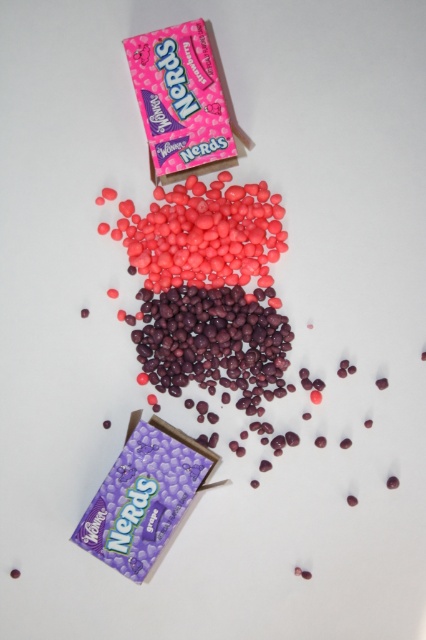
You are organizing a candy display and need to know the size difference between the glossy pink nerds at center and the pink matte nerds at upper left. Which one has a larger width?

The glossy pink nerds at center has a larger width than the pink matte nerds at upper left.

You are organizing a candy display and need to place a new sign. The sign will be placed at point coordinates between the glossy pink nerds at center and the purple package at bottom left corner. Based on their positions, which object is closer to the sign?

The glossy pink nerds at center is located at point coordinates closer to the sign than the purple package at bottom left corner, so the glossy pink nerds at center would be nearer to the sign.

You are standing in front of the two Wonka Nerds packages. You notice two points marked on the image. The first point is at coordinate point (239,218) and the second is at point (210,163). Which point is closer to you?

Point (210,163) is closer to you because it is in front of point (239,218) according to their spatial arrangement.